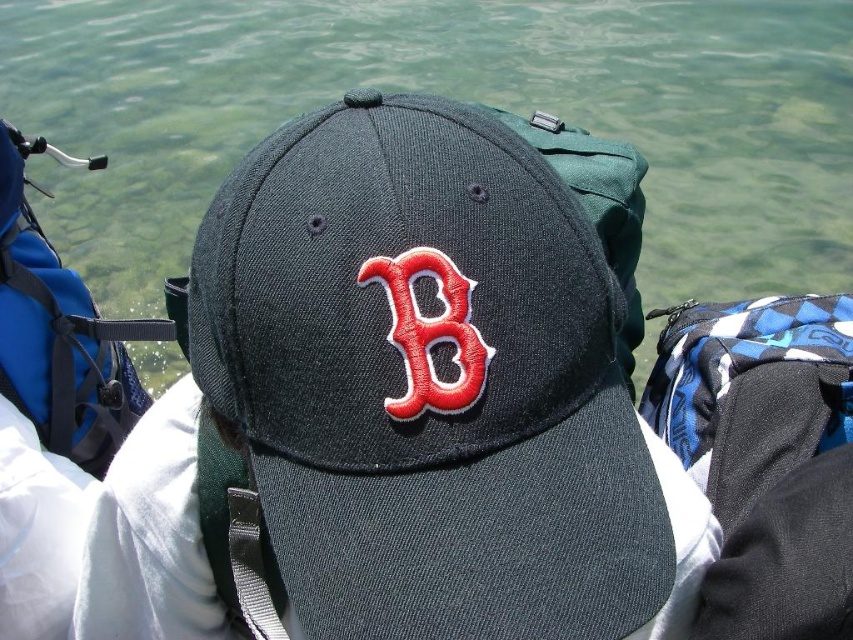
Is dark gray fabric baseball cap at center below clear water at center?

Yes.

Between dark gray fabric baseball cap at center and clear water at center, which one has more height?

Standing taller between the two is dark gray fabric baseball cap at center.

Identify the location of dark gray fabric baseball cap at center. (426, 380).

Can you confirm if dark gray fabric baseball cap at center is smaller than red fabric letter b at center?

No, dark gray fabric baseball cap at center is not smaller than red fabric letter b at center.

Locate an element on the screen. The image size is (853, 640). dark gray fabric baseball cap at center is located at coordinates (426, 380).

Identify the location of dark gray fabric baseball cap at center. This screenshot has width=853, height=640. (426, 380).

Is clear water at center positioned in front of red fabric letter b at center?

That is False.

Who is shorter, clear water at center or red fabric letter b at center?

Standing shorter between the two is red fabric letter b at center.

The width and height of the screenshot is (853, 640). I want to click on clear water at center, so click(453, 97).